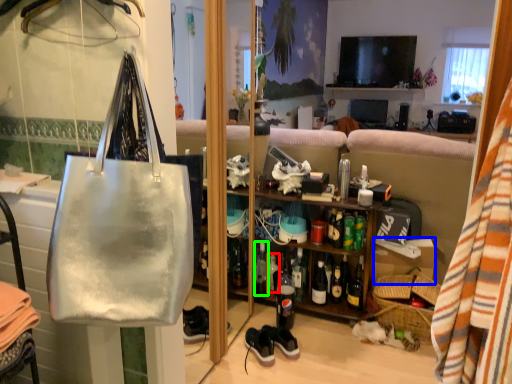
Question: Which is nearer to the bottle (highlighted by a red box)? box (highlighted by a blue box) or bottle (highlighted by a green box).

Choices:
 (A) box
 (B) bottle

Answer: (B)